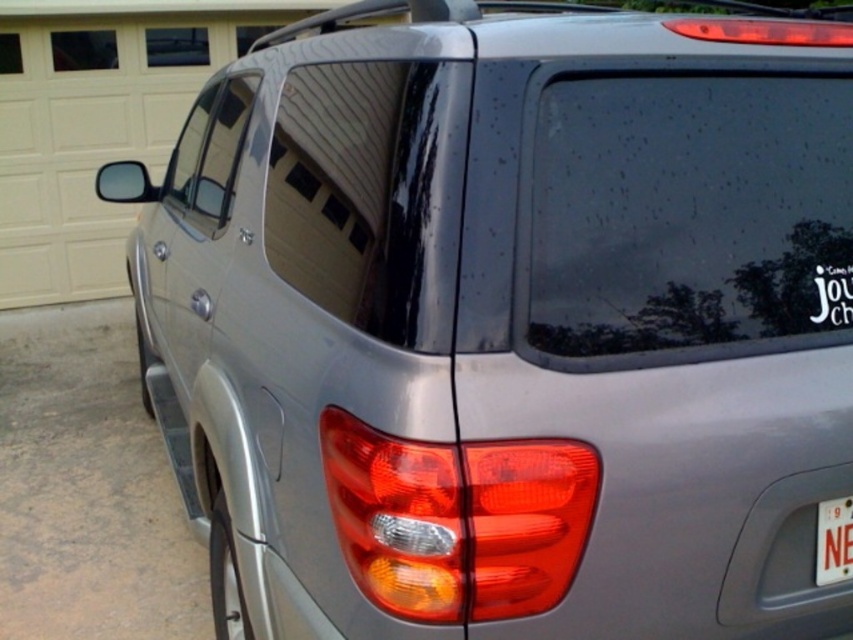
Who is taller, matte plastic tail light at center or white plastic license plate at lower right?

With more height is matte plastic tail light at center.

Does matte plastic tail light at center have a smaller size compared to white plastic license plate at lower right?

Actually, matte plastic tail light at center might be larger than white plastic license plate at lower right.

The height and width of the screenshot is (640, 853). I want to click on matte plastic tail light at center, so click(x=457, y=518).